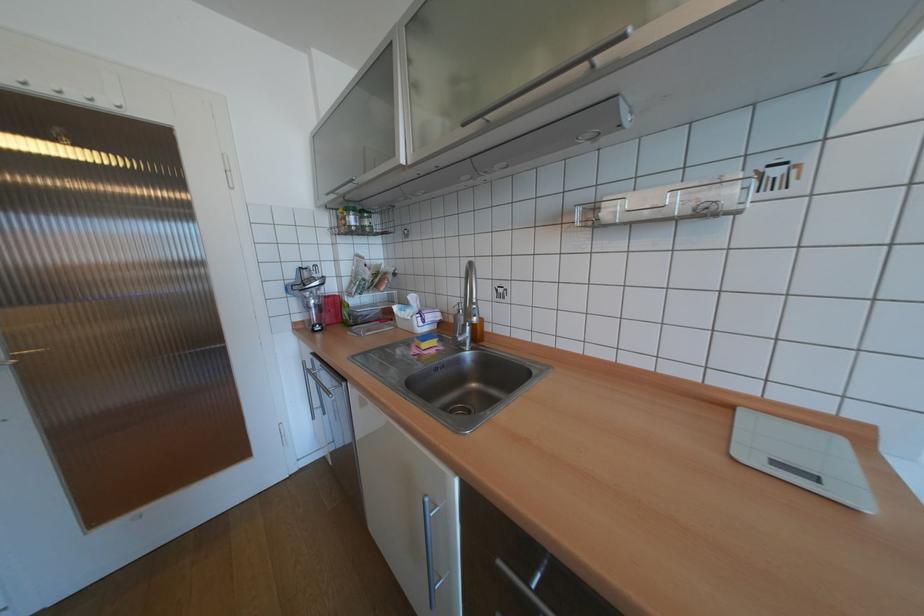
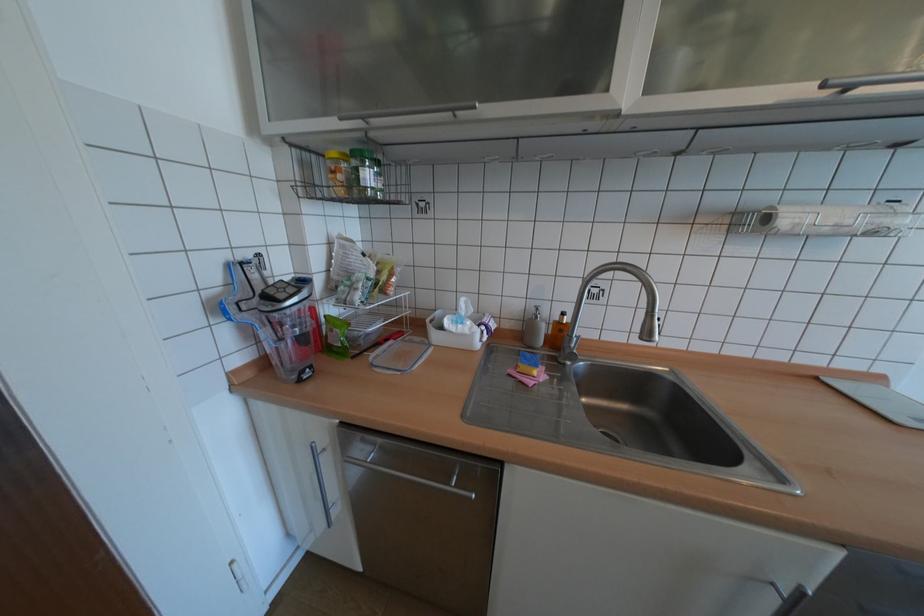
Where in the second image is the point corresponding to pixel 701 204 from the first image?

(881, 227)